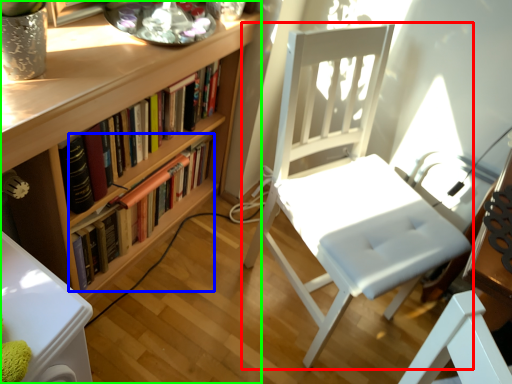
Question: Which object is positioned farthest from chair (highlighted by a red box)? Select from book (highlighted by a blue box) and bookcase (highlighted by a green box).

Choices:
 (A) book
 (B) bookcase

Answer: (A)